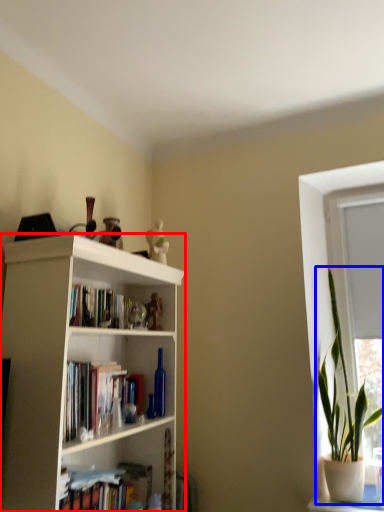
Question: Which of the following is the closest to the observer, bookcase (highlighted by a red box) or houseplant (highlighted by a blue box)?

Choices:
 (A) bookcase
 (B) houseplant

Answer: (A)